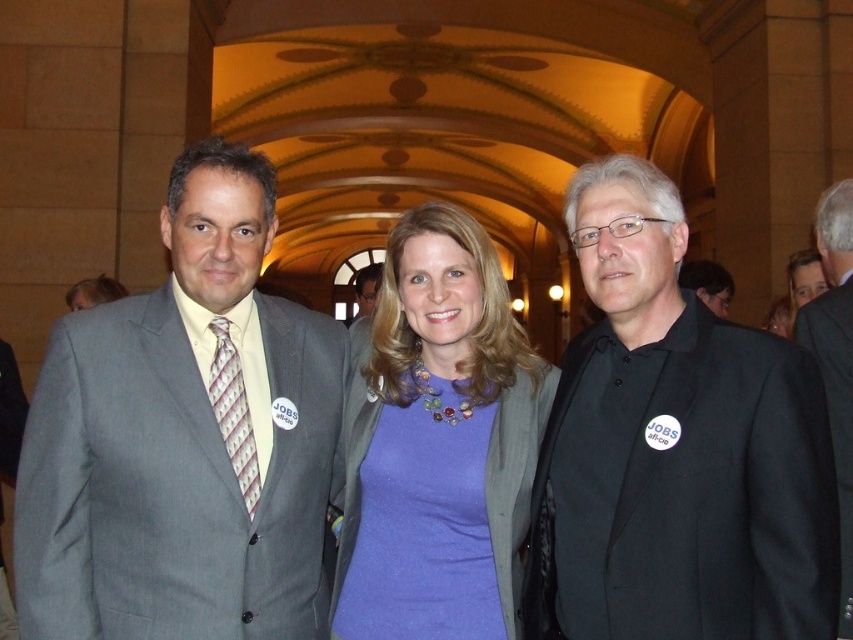
You are organizing a photo shoot and need to arrange two models wearing the purple matte dress at center and the black matte suit at center. Based on the scene description, which model should stand in front to ensure both are visible in the photo?

The purple matte dress at center is taller than the black matte suit at center. To ensure both are visible, the black matte suit at center should stand in front since it is shorter.

Consider the image. You are taking a photo of the scene and want to focus on both the point at coordinates point (352,435) and point (408,486). Which point should you adjust your focus to first to ensure both are in focus?

Point (352,435) is further to the camera than point (408,486). To ensure both are in focus, adjust focus starting from the closer point, which is point (408,486) first.